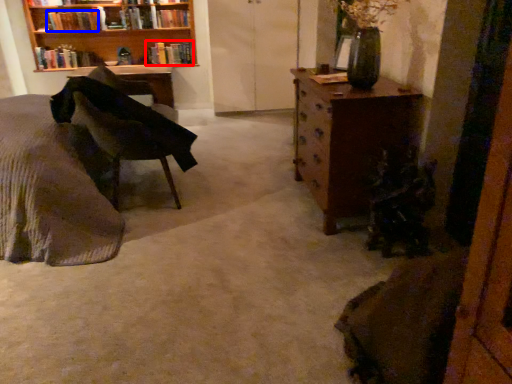
Question: Which object appears farthest to the camera in this image, book (highlighted by a red box) or book (highlighted by a blue box)?

Choices:
 (A) book
 (B) book

Answer: (A)